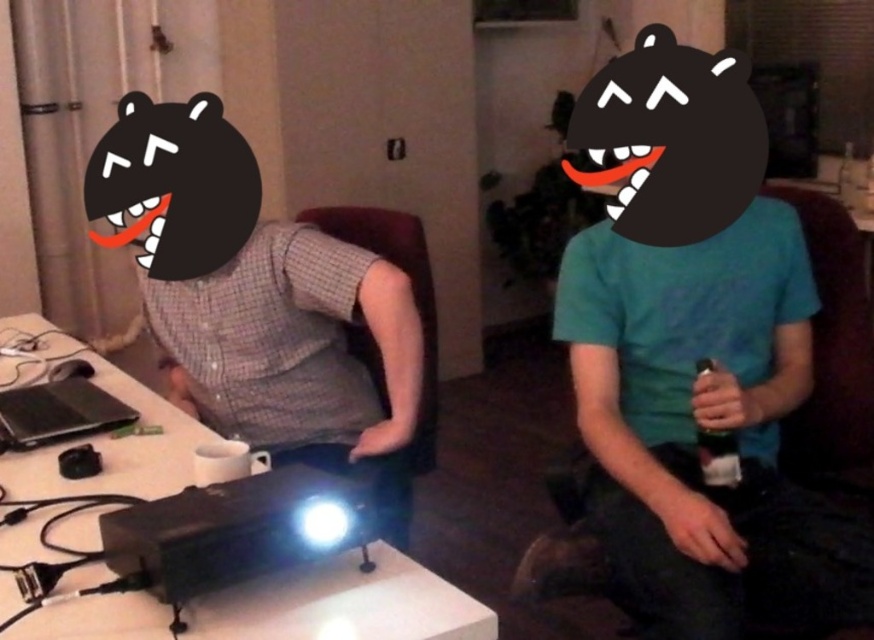
Question: Which of these objects is positioned closest to the white glossy projector at center?

Choices:
 (A) black plastic bottle at right
 (B) gray checkered shirt at center

Answer: (B)

Question: Estimate the real-world distances between objects in this image. Which object is farther from the black plastic bottle at right?

Choices:
 (A) white glossy projector at center
 (B) gray checkered shirt at center

Answer: (A)

Question: Is gray checkered shirt at center further to camera compared to black plastic bottle at right?

Choices:
 (A) yes
 (B) no

Answer: (A)

Question: Which point appears closest to the camera in this image?

Choices:
 (A) tap(705, 371)
 (B) tap(272, 620)

Answer: (B)

Question: Is white glossy projector at center below black plastic bottle at right?

Choices:
 (A) no
 (B) yes

Answer: (B)

Question: Does white glossy projector at center have a larger size compared to black plastic bottle at right?

Choices:
 (A) yes
 (B) no

Answer: (A)